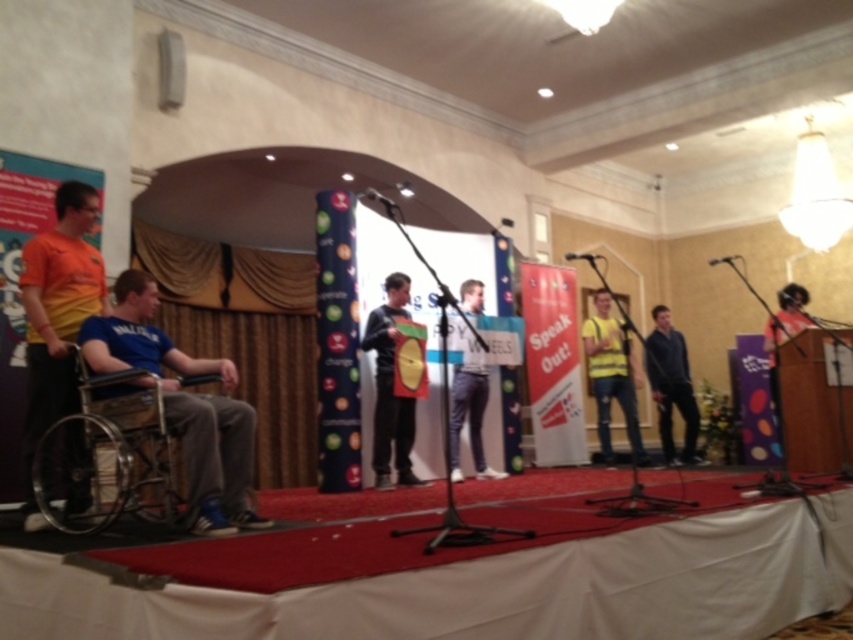
Question: Which object appears closest to the camera in this image?

Choices:
 (A) light blue jeans at center
 (B) black plastic microphone at center

Answer: (A)

Question: Among these objects, which one is nearest to the camera?

Choices:
 (A) black plastic microphone at center
 (B) black fabric jacket at center
 (C) metallic silver wheelchair at left

Answer: (C)

Question: Where is orange fabric pants at left located in relation to yellow matte vest at center in the image?

Choices:
 (A) below
 (B) above

Answer: (B)

Question: Which point is farther from the camera taking this photo?

Choices:
 (A) (608, 454)
 (B) (714, 259)
 (C) (379, 388)

Answer: (B)

Question: Does black fabric jacket at center have a lesser width compared to light blue jeans at center?

Choices:
 (A) no
 (B) yes

Answer: (B)

Question: Does black fabric jacket at center have a greater width compared to light blue jeans at center?

Choices:
 (A) no
 (B) yes

Answer: (A)